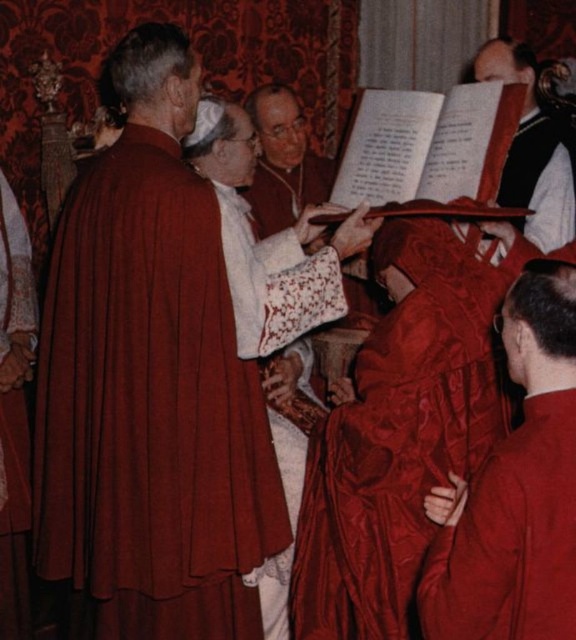
Between satin red robe at left and smooth black vest at upper right, which one has more height?

Standing taller between the two is satin red robe at left.

Can you confirm if satin red robe at left is positioned below smooth black vest at upper right?

Correct, satin red robe at left is located below smooth black vest at upper right.

Which is in front, point (18, 600) or point (544, 216)?

Positioned in front is point (18, 600).

Image resolution: width=576 pixels, height=640 pixels. Find the location of `satin red robe at left`. satin red robe at left is located at coordinates (x=14, y=412).

This screenshot has width=576, height=640. Find the location of `matte red robe at left`. matte red robe at left is located at coordinates (149, 408).

Who is lower down, matte red robe at left or smooth black vest at upper right?

matte red robe at left

The image size is (576, 640). I want to click on matte red robe at left, so click(149, 408).

Between matte red robe at left and satin red robe at lower right, which one is positioned lower?

satin red robe at lower right is lower down.

Based on the photo, is matte red robe at left above satin red robe at lower right?

Yes.

Where is `matte red robe at left`? The height and width of the screenshot is (640, 576). matte red robe at left is located at coordinates (149, 408).

You are a GUI agent. You are given a task and a screenshot of the screen. Output one action in this format:
    pyautogui.click(x=<x>, y=<y>)
    Task: Click on the matte red robe at left
    
    Given the screenshot: What is the action you would take?
    pyautogui.click(x=149, y=408)